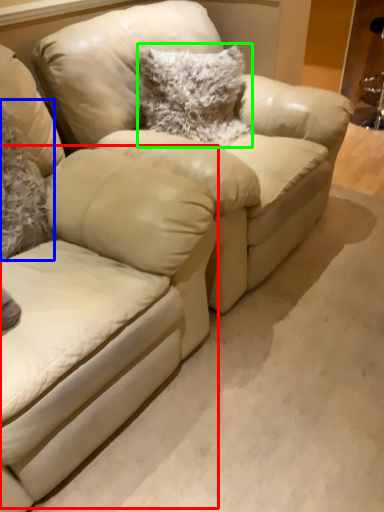
Question: Estimate the real-world distances between objects in this image. Which object is closer to swivel chair (highlighted by a red box), pillow (highlighted by a blue box) or pillow (highlighted by a green box)?

Choices:
 (A) pillow
 (B) pillow

Answer: (A)